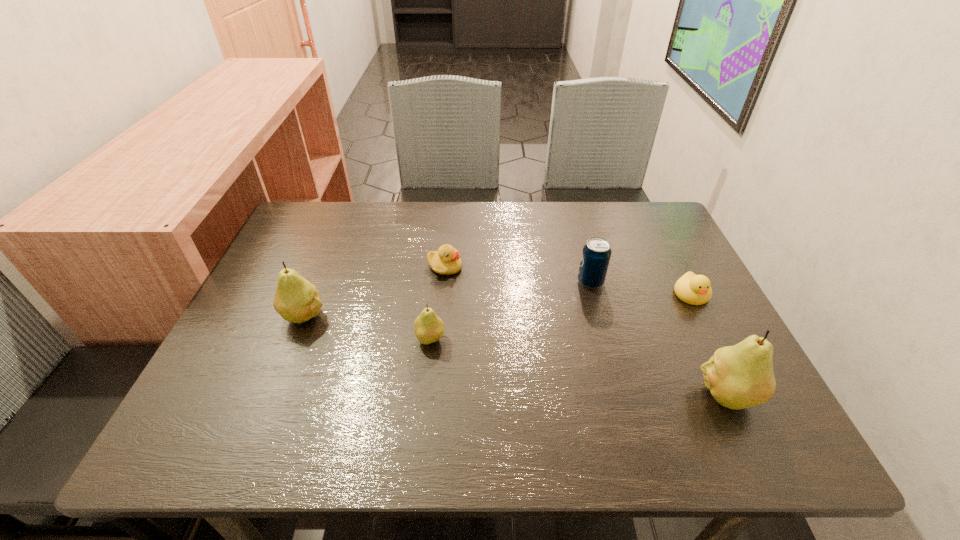
The height and width of the screenshot is (540, 960). What are the coordinates of `the leftmost object` in the screenshot? It's located at (297, 300).

This screenshot has height=540, width=960. I want to click on the fifth shortest object, so click(297, 300).

Find the location of a particular element. The image size is (960, 540). the shortest pear is located at coordinates (429, 328).

Identify the location of the rightmost pear. (740, 376).

Find the location of a particular element. the nearest pear is located at coordinates (740, 376).

I want to click on the right duckling, so (x=693, y=289).

The height and width of the screenshot is (540, 960). Identify the location of the left duckling. (446, 261).

At what (x,y) coordinates should I click in order to perform the action: click on soda can. Please return your answer as a coordinate pair (x, y). The width and height of the screenshot is (960, 540). Looking at the image, I should click on (596, 253).

The height and width of the screenshot is (540, 960). In order to click on vacant space located 0.200m on the right of the leftmost pear in this screenshot , I will do `click(412, 315)`.

The image size is (960, 540). Identify the location of vacant position located 0.250m on the right of the shortest pear. (558, 339).